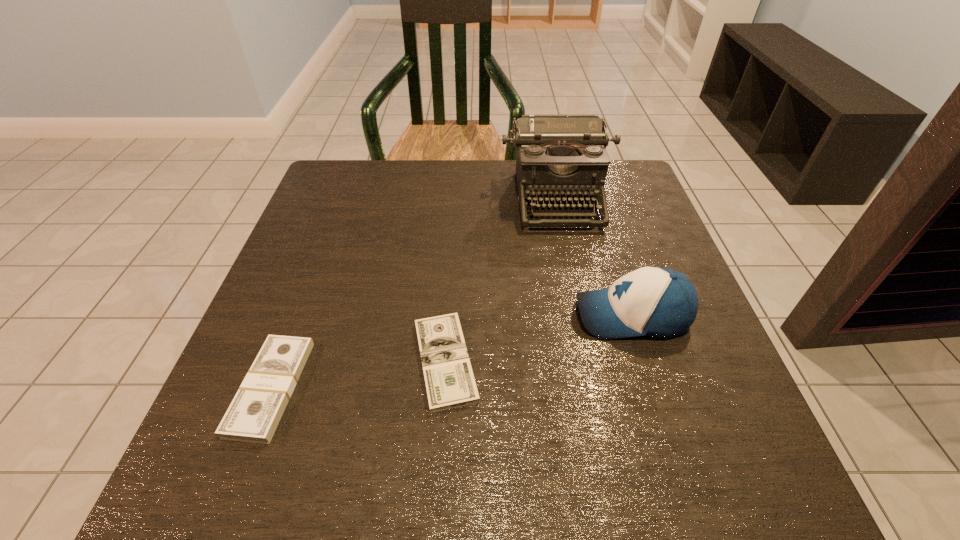
I want to click on vacant space located 0.070m on the front-facing side of the baseball cap, so click(x=539, y=315).

Where is `free space located 0.260m on the right of the third tallest object`? free space located 0.260m on the right of the third tallest object is located at coordinates (456, 388).

Locate an element on the screen. Image resolution: width=960 pixels, height=540 pixels. free space located on the back of the third object from right to left is located at coordinates (451, 273).

Find the location of a particular element. This screenshot has width=960, height=540. object located in the far edge section of the desktop is located at coordinates (558, 156).

At what (x,y) coordinates should I click in order to perform the action: click on object that is at the near edge. Please return your answer as a coordinate pair (x, y). This screenshot has width=960, height=540. Looking at the image, I should click on (253, 416).

This screenshot has height=540, width=960. I want to click on object that is at the left edge, so click(x=253, y=416).

Locate an element on the screen. The height and width of the screenshot is (540, 960). typewriter that is at the right edge is located at coordinates (558, 156).

This screenshot has height=540, width=960. Find the location of `baseball cap located at the right edge`. baseball cap located at the right edge is located at coordinates (651, 301).

Locate an element on the screen. The image size is (960, 540). object situated at the near left corner is located at coordinates (253, 416).

I want to click on object that is positioned at the far right corner, so click(x=558, y=156).